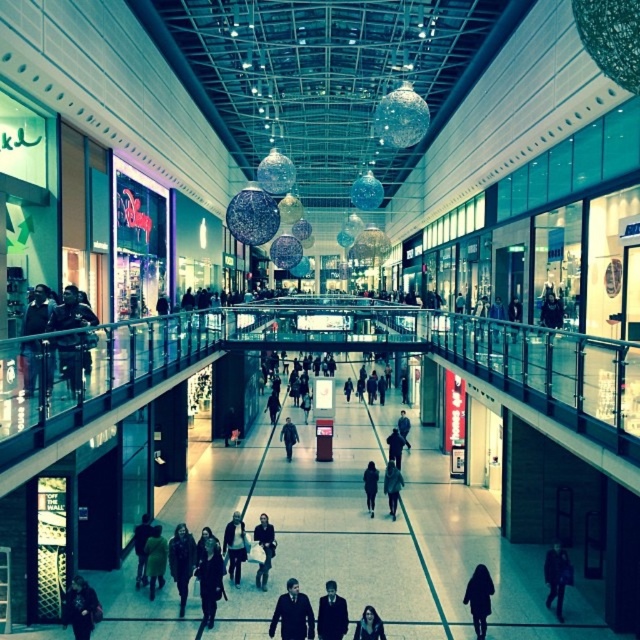
In the scene shown: Is dark blue suit at center positioned behind dark brown leather coat at lower right?

No, it is not.

The image size is (640, 640). What do you see at coordinates (332, 612) in the screenshot?
I see `dark blue suit at center` at bounding box center [332, 612].

Who is more distant from viewer, [332,612] or [568,563]?

Positioned behind is point [568,563].

Where is `dark blue suit at center`? The width and height of the screenshot is (640, 640). dark blue suit at center is located at coordinates (332, 612).

From the picture: Is dark gray jacket at lower left closer to the viewer compared to dark blue suit at center?

Yes.

Which is below, dark gray jacket at lower left or dark blue suit at center?

dark blue suit at center is lower down.

The image size is (640, 640). I want to click on dark gray jacket at lower left, so click(x=81, y=609).

Does dark gray jacket at lower left appear on the right side of dark brown hair at center?

No, dark gray jacket at lower left is not to the right of dark brown hair at center.

Who is positioned more to the left, dark gray jacket at lower left or dark brown hair at center?

dark gray jacket at lower left is more to the left.

At what (x,y) coordinates should I click in order to perform the action: click on dark gray jacket at lower left. Please return your answer as a coordinate pair (x, y). The image size is (640, 640). Looking at the image, I should click on (81, 609).